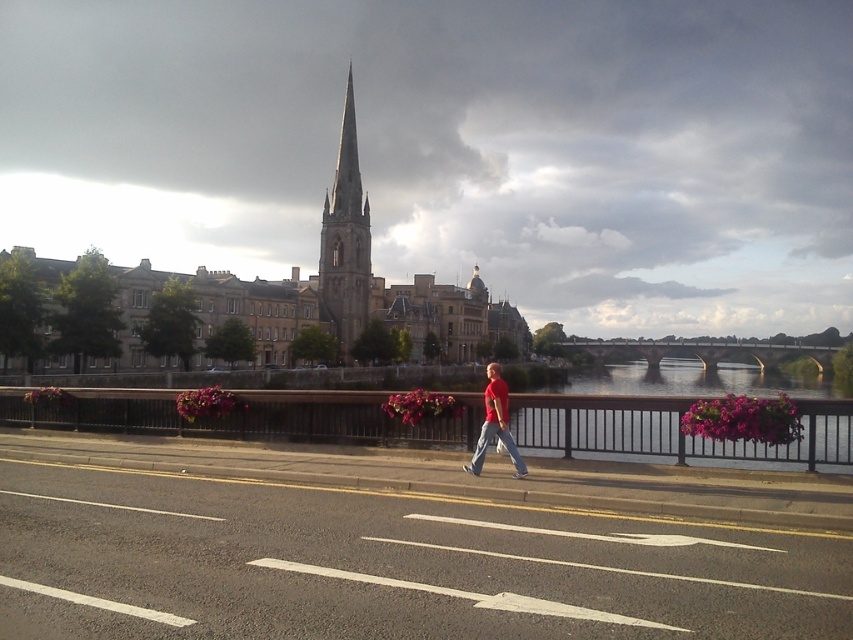
You are a pedestrian standing on the sidewalk next to the road. You see a clear water at bridge right and a matte red shirt at center. Which object is closer to the ground?

The clear water at bridge right is closer to the ground because it is below the matte red shirt at center.

You are standing at the center of the image and see the point marked at coordinates (345, 241). What object is this point located on?

The point marked at coordinates (345, 241) is located on the smooth stone spire at center.